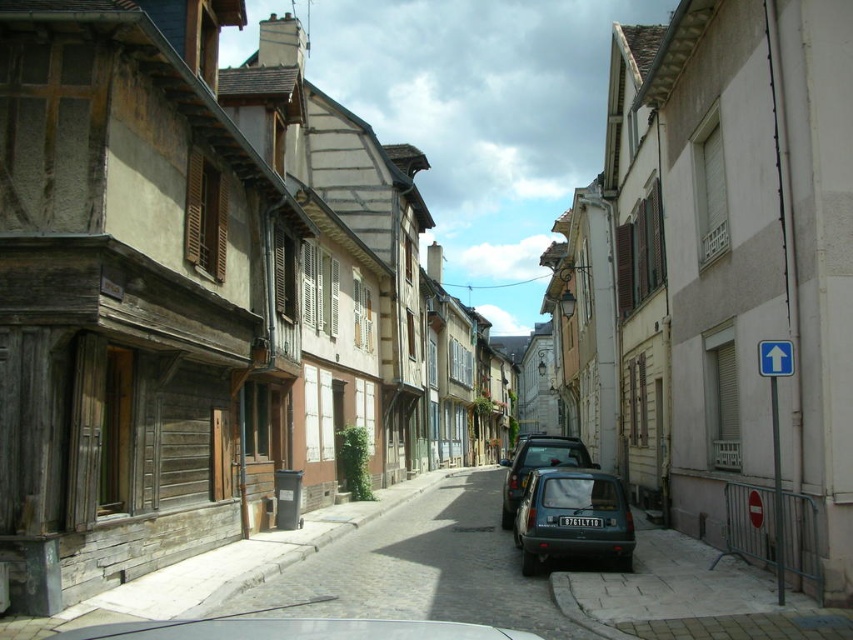
Question: Can you confirm if matte dark green car at center is thinner than matte black car at center?

Choices:
 (A) no
 (B) yes

Answer: (B)

Question: Where is matte black car at center located in relation to black plastic license plate at center in the image?

Choices:
 (A) above
 (B) below

Answer: (B)

Question: Which point appears farthest from the camera in this image?

Choices:
 (A) (548, 540)
 (B) (518, 461)

Answer: (B)

Question: Does matte dark green car at center have a smaller size compared to black plastic license plate at center?

Choices:
 (A) yes
 (B) no

Answer: (B)

Question: Among these objects, which one is nearest to the camera?

Choices:
 (A) matte black car at center
 (B) matte dark green car at center

Answer: (B)

Question: Among these objects, which one is nearest to the camera?

Choices:
 (A) black plastic license plate at center
 (B) matte dark green car at center
 (C) matte black car at center

Answer: (B)